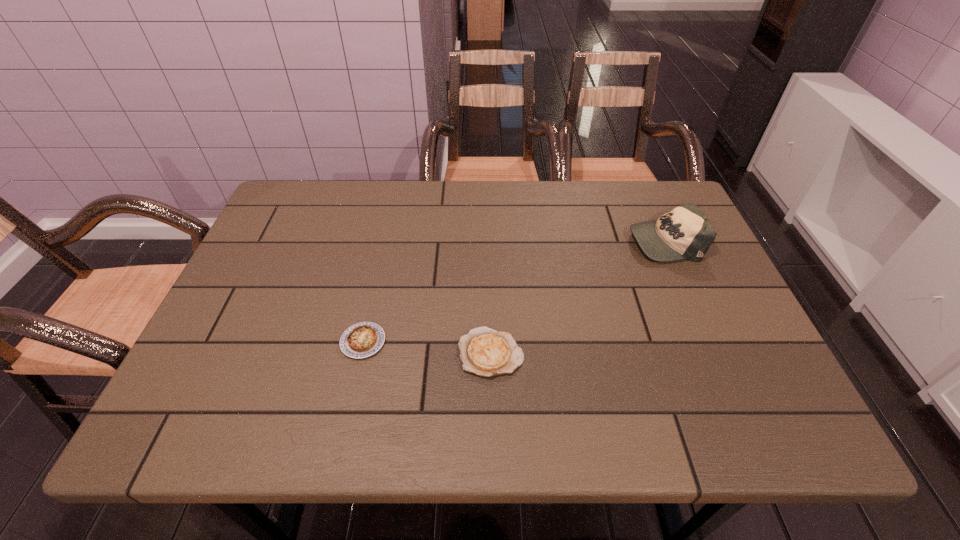
Select which object is the second closest to the farthest object. Please provide its 2D coordinates. Your answer should be formatted as a tuple, i.e. [(x, y)], where the tuple contains the x and y coordinates of a point satisfying the conditions above.

[(363, 339)]

The height and width of the screenshot is (540, 960). Identify the location of free space that satisfies the following two spatial constraints: 1. on the front side of the second object from left to right; 2. on the right side of the left quiche. [360, 353].

Identify the location of vacant area in the image that satisfies the following two spatial constraints: 1. on the front-facing side of the rightmost object; 2. on the front side of the right quiche. The image size is (960, 540). (713, 353).

This screenshot has height=540, width=960. What are the coordinates of `blank space that satisfies the following two spatial constraints: 1. on the front-facing side of the farthest object; 2. on the front side of the leftmost object` in the screenshot? It's located at (708, 342).

Identify the location of free region that satisfies the following two spatial constraints: 1. on the front-facing side of the rightmost object; 2. on the front side of the leftmost object. The image size is (960, 540). (708, 342).